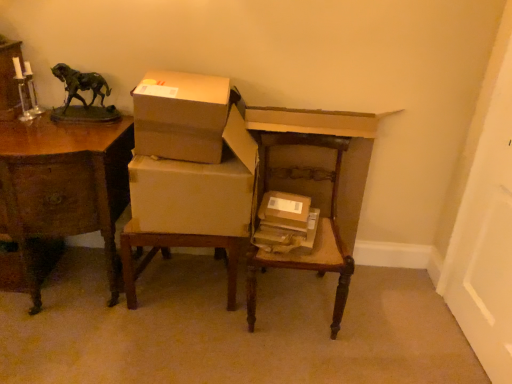
Describe the element at coordinates (197, 189) in the screenshot. I see `matte cardboard boxes at center` at that location.

This screenshot has height=384, width=512. What do you see at coordinates (285, 210) in the screenshot? I see `brown cardboard box at center, the first box when ordered from bottom to top` at bounding box center [285, 210].

What do you see at coordinates (64, 185) in the screenshot? This screenshot has width=512, height=384. I see `wooden desk at left` at bounding box center [64, 185].

I want to click on wooden chair at center, so click(x=298, y=212).

Describe the element at coordinates (80, 84) in the screenshot. This screenshot has width=512, height=384. I see `green patina bronze horse at upper left` at that location.

This screenshot has height=384, width=512. Find the location of `matte cardboard boxes at center`. matte cardboard boxes at center is located at coordinates (197, 189).

Considering the relative sizes of wooden desk at left and brown cardboard box at upper center, which appears as the 2th box when viewed from the right, in the image provided, is wooden desk at left bigger than brown cardboard box at upper center, which appears as the 2th box when viewed from the right,?

Yes.

Is wooden desk at left with brown cardboard box at upper center, which appears as the 2th box when viewed from the right?

wooden desk at left is not next to brown cardboard box at upper center, which appears as the 2th box when viewed from the right, and they're not touching.

Does wooden desk at left come behind brown cardboard box at upper center, which appears as the 2th box when viewed from the right?

That is False.

From the image's perspective, is wooden desk at left on brown cardboard box at upper center, acting as the second box starting from the bottom?

No, from the image's perspective, wooden desk at left is not above brown cardboard box at upper center, acting as the second box starting from the bottom.

Does point (86, 75) lie behind point (290, 208)?

Yes, it is behind point (290, 208).

From the image's perspective, which is below, green patina bronze horse at upper left or brown cardboard box at center, which ranks as the 2th box in top-to-bottom order?

From the image's view, brown cardboard box at center, which ranks as the 2th box in top-to-bottom order, is below.

Between green patina bronze horse at upper left and brown cardboard box at center, the first box when ordered from bottom to top, which one has smaller size?

brown cardboard box at center, the first box when ordered from bottom to top.

From the picture: What's the angular difference between brown cardboard box at center and green patina bronze horse at upper left's facing directions?

brown cardboard box at center and green patina bronze horse at upper left are facing 12.6 degrees away from each other.

Is point (274, 201) positioned before point (87, 85)?

Yes, point (274, 201) is closer to viewer.

Considering the sizes of objects brown cardboard box at center and green patina bronze horse at upper left in the image provided, who is thinner, brown cardboard box at center or green patina bronze horse at upper left?

green patina bronze horse at upper left.

From a real-world perspective, is brown cardboard box at center above or below green patina bronze horse at upper left?

In terms of real-world spatial position, brown cardboard box at center is below green patina bronze horse at upper left.

From the image's perspective, is wooden desk at left located beneath wooden chair at center?

No, from the image's perspective, wooden desk at left is not beneath wooden chair at center.

Which is behind, wooden desk at left or wooden chair at center?

wooden desk at left is further from the camera.

From a real-world perspective, between wooden desk at left and wooden chair at center, who is vertically higher?

wooden desk at left is physically above.

What's the angular difference between wooden desk at left and brown cardboard box at center's facing directions?

The angle between the facing direction of wooden desk at left and the facing direction of brown cardboard box at center is 10.8 degrees.

Is wooden desk at left positioned behind brown cardboard box at center?

No, wooden desk at left is in front of brown cardboard box at center.

From the image's perspective, is wooden desk at left located beneath brown cardboard box at center?

No, from the image's perspective, wooden desk at left is not below brown cardboard box at center.

Considering the relative sizes of wooden desk at left and brown cardboard box at center in the image provided, is wooden desk at left wider than brown cardboard box at center?

Indeed, wooden desk at left has a greater width compared to brown cardboard box at center.

Identify the location of cardboard box above the brown cardboard box at center, positioned as the 1th box in right-to-left order (from a real-world perspective). (197, 189).

Can you confirm if matte cardboard boxes at center is smaller than brown cardboard box at center, which ranks as the 2th box in top-to-bottom order?

Incorrect, matte cardboard boxes at center is not smaller in size than brown cardboard box at center, which ranks as the 2th box in top-to-bottom order.

Considering the relative sizes of matte cardboard boxes at center and brown cardboard box at center, which appears as the 2th box when viewed from the left, in the image provided, is matte cardboard boxes at center taller than brown cardboard box at center, which appears as the 2th box when viewed from the left,?

Correct, matte cardboard boxes at center is much taller as brown cardboard box at center, which appears as the 2th box when viewed from the left.

From a real-world perspective, does matte cardboard boxes at center sit lower than wooden chair at center?

Actually, matte cardboard boxes at center is physically above wooden chair at center in the real world.

Does matte cardboard boxes at center have a smaller size compared to wooden chair at center?

Correct, matte cardboard boxes at center occupies less space than wooden chair at center.

What's the angular difference between matte cardboard boxes at center and wooden chair at center's facing directions?

4.27 degrees.

Considering the positions of objects matte cardboard boxes at center and wooden chair at center in the image provided, who is more to the left, matte cardboard boxes at center or wooden chair at center?

Positioned to the left is matte cardboard boxes at center.

Locate an element on the screen. desk below the brown cardboard box at upper center, the 1th box in the top-to-bottom sequence (from the image's perspective) is located at coordinates (64, 185).

This screenshot has height=384, width=512. Identify the location of the 1st box in front of the green patina bronze horse at upper left, counting from the anchor's position. (285, 210).

Based on their spatial positions, is brown cardboard box at center, which ranks as the 2th box in top-to-bottom order, or wooden desk at left closer to wooden chair at center?

Based on the image, brown cardboard box at center, which ranks as the 2th box in top-to-bottom order, appears to be nearer to wooden chair at center.

Considering their positions, is matte cardboard boxes at center positioned closer to wooden chair at center than brown cardboard box at center, which ranks as the 2th box in top-to-bottom order?

brown cardboard box at center, which ranks as the 2th box in top-to-bottom order, is positioned closer to the anchor wooden chair at center.

Estimate the real-world distances between objects in this image. Which object is further from brown cardboard box at upper center, which ranks as the first box in left-to-right order, matte cardboard boxes at center or wooden chair at center?

wooden chair at center is further to brown cardboard box at upper center, which ranks as the first box in left-to-right order.

Estimate the real-world distances between objects in this image. Which object is closer to brown cardboard box at upper center, acting as the second box starting from the bottom, green patina bronze horse at upper left or brown cardboard box at center?

brown cardboard box at center is closer to brown cardboard box at upper center, acting as the second box starting from the bottom.

Considering their positions, is brown cardboard box at center, which appears as the 2th box when viewed from the left, positioned closer to brown cardboard box at center than matte cardboard boxes at center?

brown cardboard box at center, which appears as the 2th box when viewed from the left, is positioned closer to the anchor brown cardboard box at center.

Which object lies nearer to the anchor point brown cardboard box at center, which appears as the 2th box when viewed from the left, brown cardboard box at center or matte cardboard boxes at center?

The object closer to brown cardboard box at center, which appears as the 2th box when viewed from the left, is brown cardboard box at center.

When comparing their distances from wooden desk at left, does brown cardboard box at center or matte cardboard boxes at center seem further?

brown cardboard box at center lies further to wooden desk at left than the other object.

Which object lies nearer to the anchor point matte cardboard boxes at center, wooden chair at center or brown cardboard box at center, which ranks as the 2th box in top-to-bottom order?

Among the two, wooden chair at center is located nearer to matte cardboard boxes at center.

This screenshot has height=384, width=512. In order to click on cardboard box between brown cardboard box at upper center, acting as the second box starting from the bottom, and wooden chair at center from left to right in this screenshot , I will do 197,189.

Locate an element on the screen. The height and width of the screenshot is (384, 512). box between green patina bronze horse at upper left and matte cardboard boxes at center in the horizontal direction is located at coordinates click(181, 116).

Locate an element on the screen. cardboard box located between green patina bronze horse at upper left and brown cardboard box at center in the left-right direction is located at coordinates (197, 189).

Find the location of `box situated between brown cardboard box at upper center, which ranks as the first box in left-to-right order, and brown cardboard box at center from left to right`. box situated between brown cardboard box at upper center, which ranks as the first box in left-to-right order, and brown cardboard box at center from left to right is located at coordinates (285, 210).